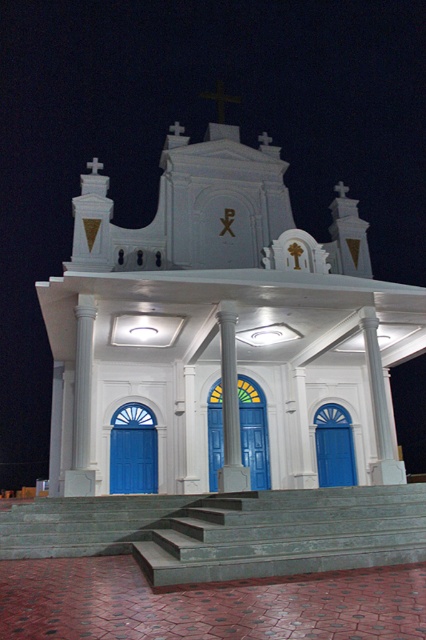
Question: Is blue glossy door at center below blue matte door at center?

Choices:
 (A) yes
 (B) no

Answer: (B)

Question: Can you confirm if white smooth column at center is positioned to the right of blue matte door at center?

Choices:
 (A) yes
 (B) no

Answer: (B)

Question: Does smooth concrete stairs at center appear on the right side of blue glossy door at center?

Choices:
 (A) yes
 (B) no

Answer: (B)

Question: Among these points, which one is nearest to the camera?

Choices:
 (A) (348, 477)
 (B) (138, 477)

Answer: (B)

Question: Which object is the closest to the white glossy church at center?

Choices:
 (A) blue matte door at center
 (B) smooth concrete stairs at center
 (C) white smooth column at center

Answer: (A)

Question: Among these points, which one is nearest to the camera?

Choices:
 (A) (353, 461)
 (B) (374, 493)

Answer: (B)